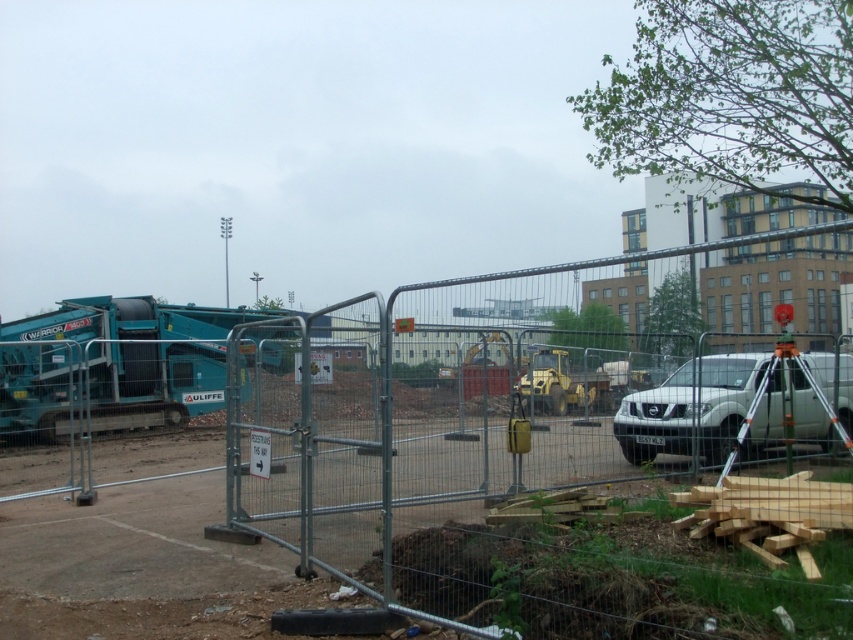
Which is more to the left, metal fence at center or teal metallic/industrial at left?

Positioned to the left is teal metallic/industrial at left.

Can you confirm if metal fence at center is smaller than teal metallic/industrial at left?

Actually, metal fence at center might be larger than teal metallic/industrial at left.

Which is in front, point (349, 509) or point (53, 413)?

Point (349, 509)

Image resolution: width=853 pixels, height=640 pixels. What are the coordinates of `metal fence at center` in the screenshot? It's located at (490, 451).

Who is lower down, teal metallic/industrial at left or white matte suv at center?

white matte suv at center is below.

Based on the photo, which is more to the left, teal metallic/industrial at left or white matte suv at center?

From the viewer's perspective, teal metallic/industrial at left appears more on the left side.

Which is in front, point (163, 378) or point (701, 412)?

Point (701, 412) is in front.

Locate an element on the screen. teal metallic/industrial at left is located at coordinates (115, 364).

Which is behind, point (631, 397) or point (672, 429)?

Positioned behind is point (631, 397).

This screenshot has height=640, width=853. What are the coordinates of `metal fence at center` in the screenshot? It's located at (490, 451).